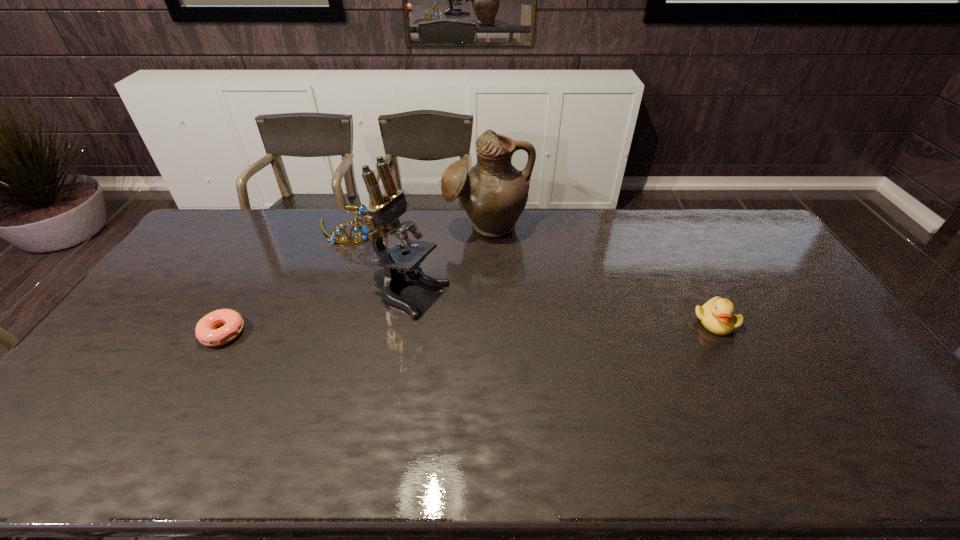
Where is `free space located 0.220m on the front-facing side of the third tallest object`? The image size is (960, 540). free space located 0.220m on the front-facing side of the third tallest object is located at coordinates (400, 273).

Find the location of a particular element. This screenshot has width=960, height=540. vacant space located 0.340m on the front-facing side of the third tallest object is located at coordinates (420, 293).

Locate an element on the screen. This screenshot has height=540, width=960. free location located on the front-facing side of the third tallest object is located at coordinates (402, 275).

Locate an element on the screen. The height and width of the screenshot is (540, 960). free space located at the eyepieces of the microscope is located at coordinates (510, 336).

Image resolution: width=960 pixels, height=540 pixels. I want to click on free point located at the eyepieces of the microscope, so click(535, 347).

The height and width of the screenshot is (540, 960). I want to click on free space located at the eyepieces of the microscope, so click(x=562, y=358).

Locate an element on the screen. vacant space located at the spout of the second tallest object is located at coordinates (492, 258).

Find the location of a particular element. This screenshot has width=960, height=540. vacant area located at the spout of the second tallest object is located at coordinates (494, 279).

Identify the location of free space located 0.360m at the spout of the second tallest object. Image resolution: width=960 pixels, height=540 pixels. (499, 320).

I want to click on tiara present at the far edge, so click(x=361, y=208).